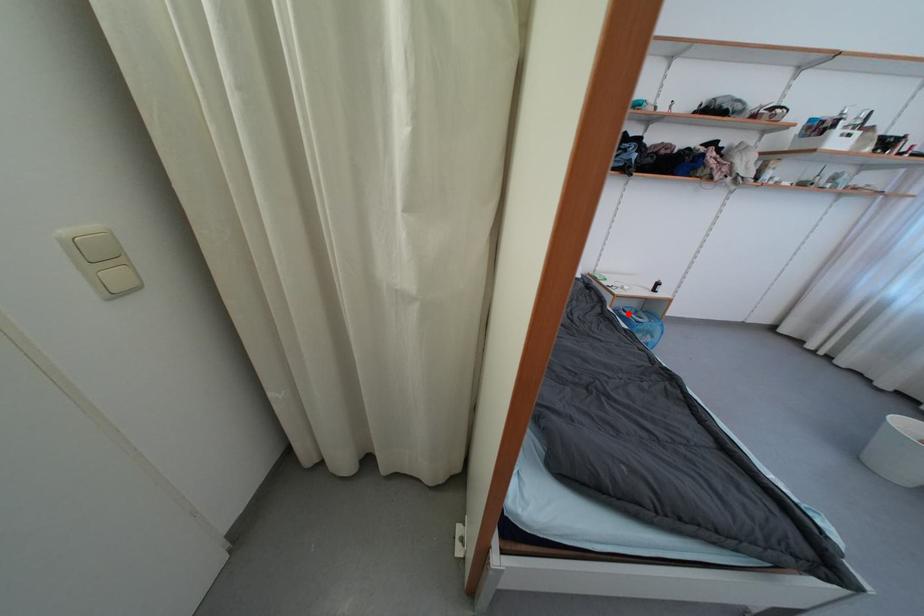
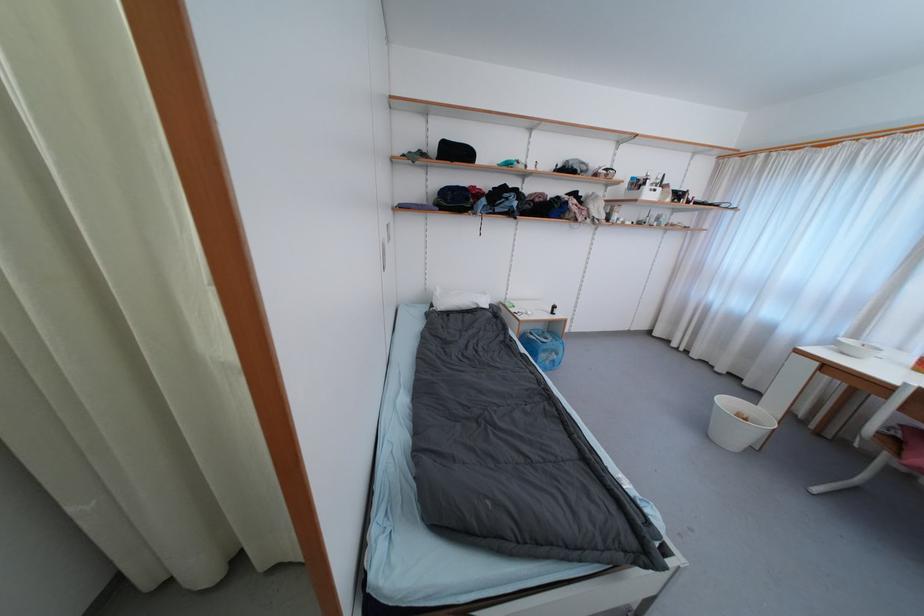
Question: I am providing you with two images of the same scene from different viewpoints. Given a red point in image1, look at the same physical point in image2. Is it:

Choices:
 (A) Closer to the viewpoint
 (B) Farther from the viewpoint

Answer: (A)